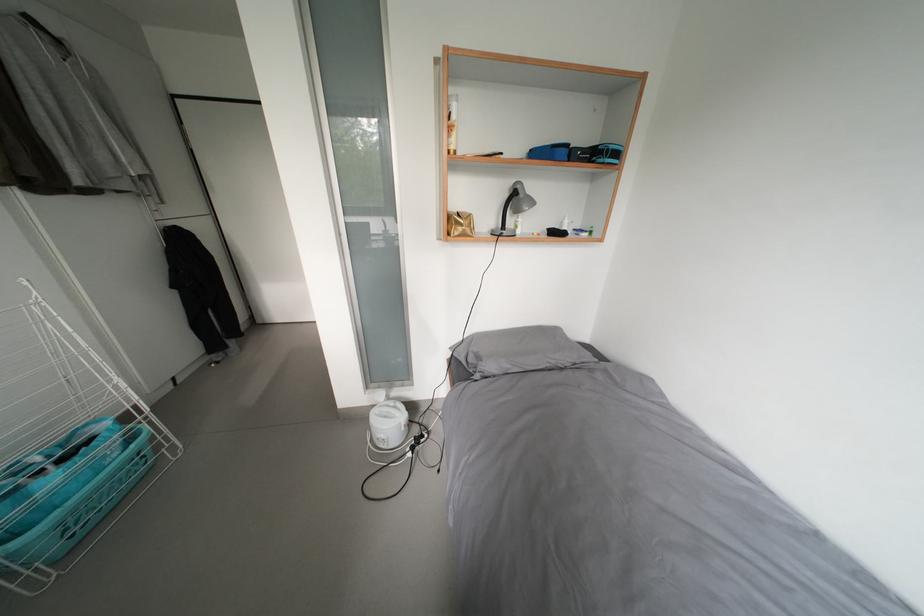
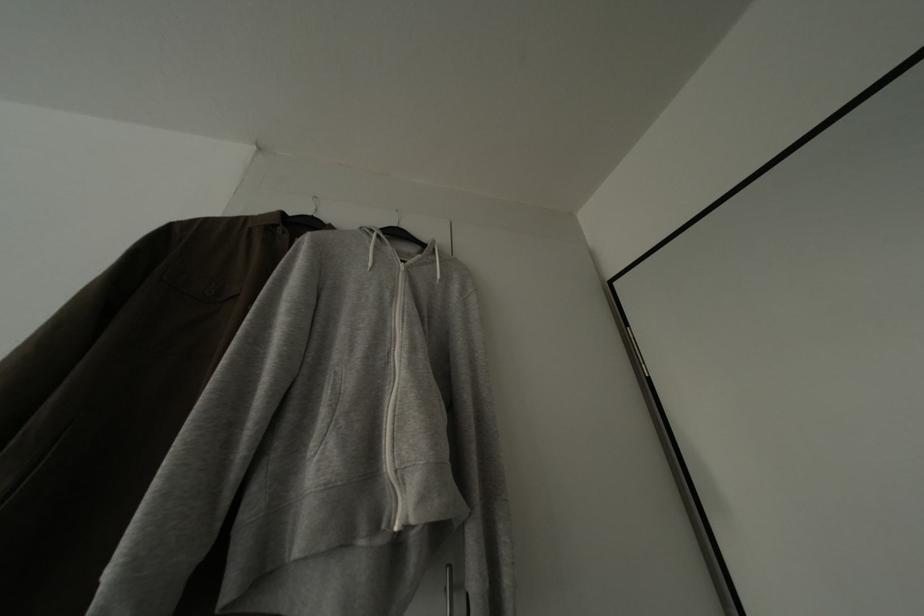
Find the pixel in the second image that matches point 67,47 in the first image.

(431, 252)